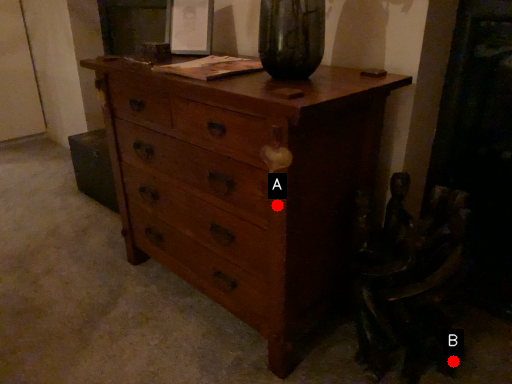
Question: Two points are circled on the image, labeled by A and B beside each circle. Among these points, which one is farthest from the camera?

Choices:
 (A) A is further
 (B) B is further

Answer: (B)